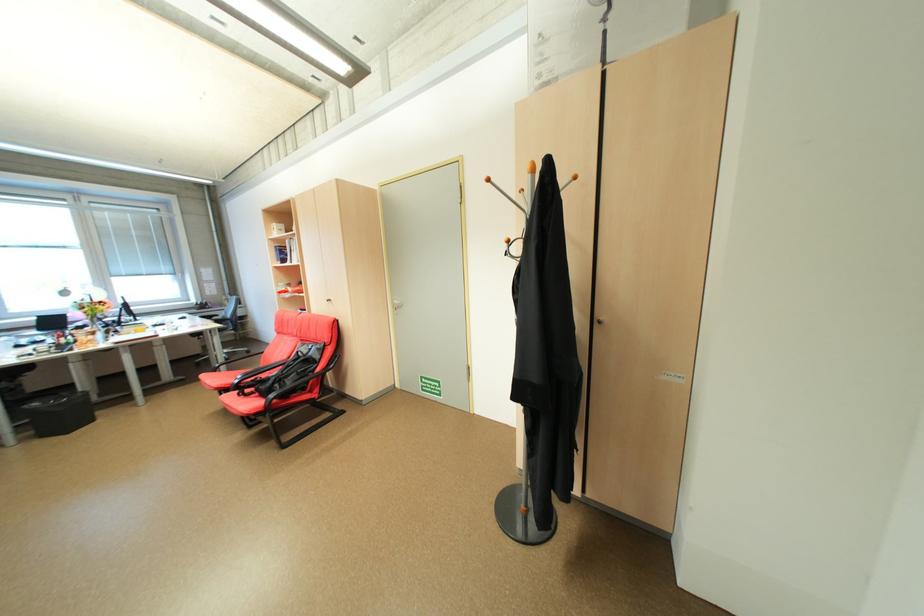
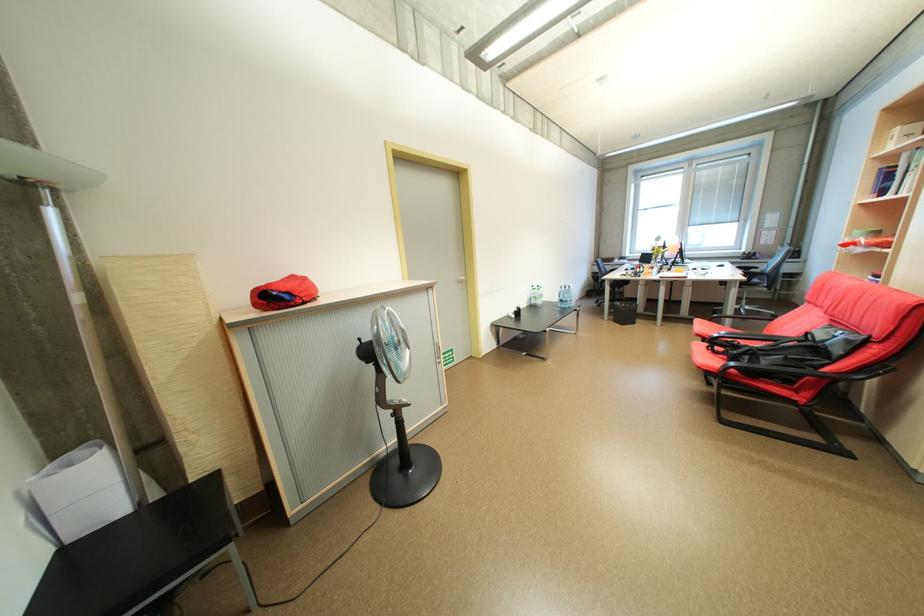
First-person continuous shooting, in which direction is the camera rotating?

The camera's rotation is toward left-down.